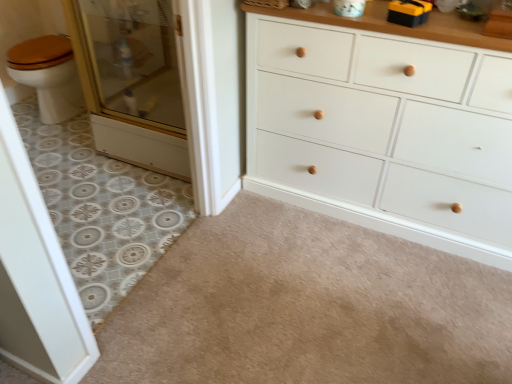
The image size is (512, 384). In order to click on vacant area situated to the left side of black plastic tool at upper right in this screenshot , I will do `click(373, 23)`.